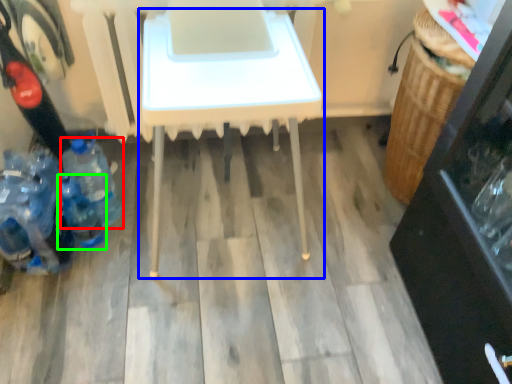
Question: Estimate the real-world distances between objects in this image. Which object is closer to bottle (highlighted by a red box), table (highlighted by a blue box) or bottle (highlighted by a green box)?

Choices:
 (A) table
 (B) bottle

Answer: (B)